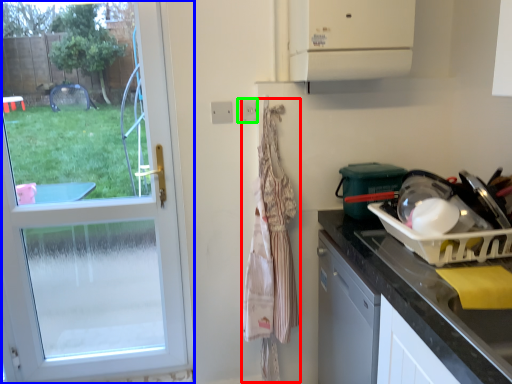
Question: Which object is positioned farthest from clothesline (highlighted by a red box)? Select from door (highlighted by a blue box) and electric outlet (highlighted by a green box).

Choices:
 (A) door
 (B) electric outlet

Answer: (A)